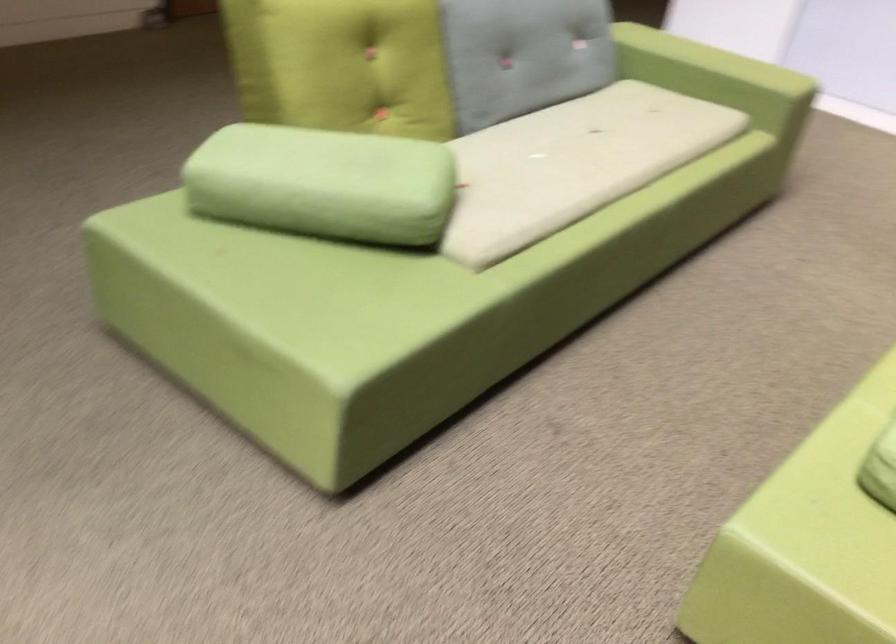
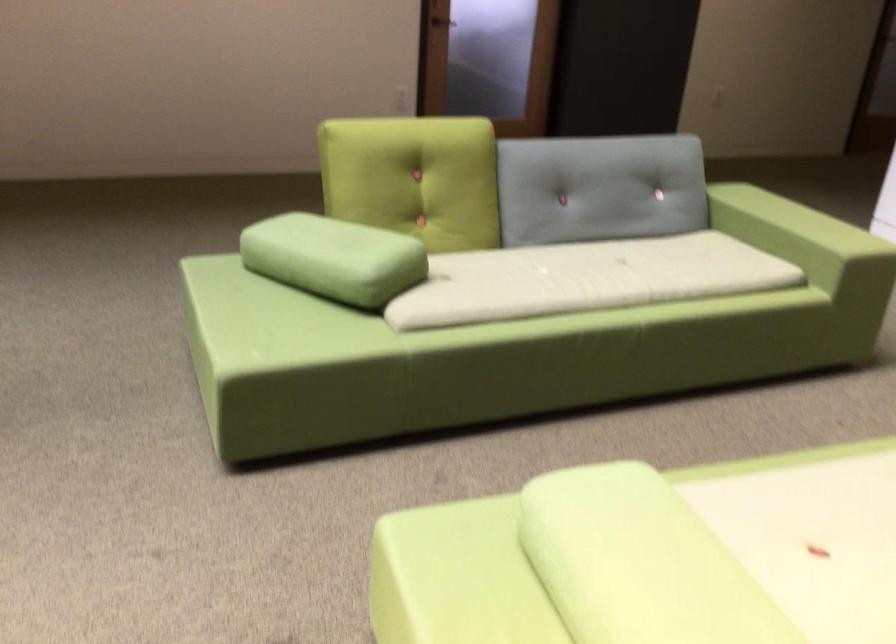
Locate, in the second image, the point that corresponds to point 366,190 in the first image.

(333, 258)